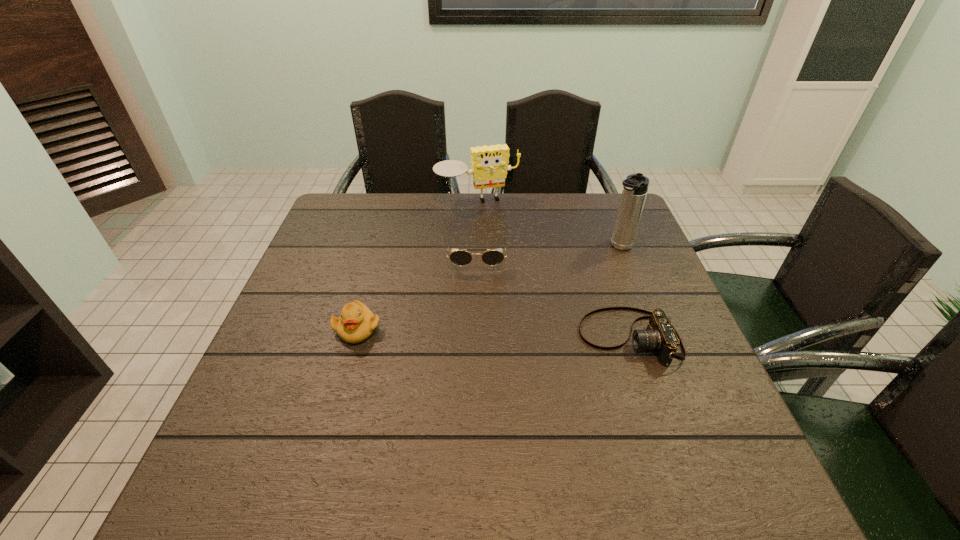
What are the coordinates of `free spot on the desktop that is between the leftmost object and the camera and is positioned on the handle side of the thermos bottle` in the screenshot? It's located at (529, 334).

You are a GUI agent. You are given a task and a screenshot of the screen. Output one action in this format:
    pyautogui.click(x=<x>, y=<y>)
    Task: Click on the vacant space on the desktop that is between the duckling and the camera and is positioned on the front-facing side of the fourth shortest object
    This screenshot has width=960, height=540.
    Given the screenshot: What is the action you would take?
    pyautogui.click(x=531, y=334)

Find the location of `vacant space on the desktop that is between the duckling and the shortest object and is positioned on the front lenses of the sunglasses`. vacant space on the desktop that is between the duckling and the shortest object and is positioned on the front lenses of the sunglasses is located at coordinates (477, 333).